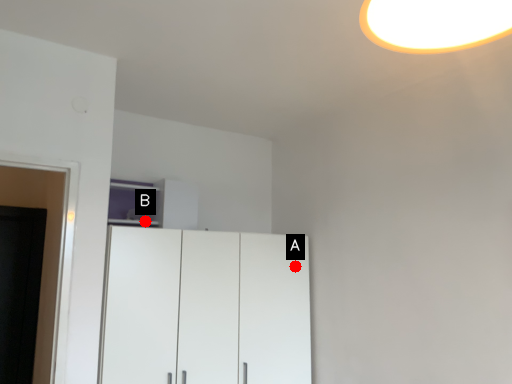
Question: Two points are circled on the image, labeled by A and B beside each circle. Which point is farther from the camera taking this photo?

Choices:
 (A) A is further
 (B) B is further

Answer: (A)